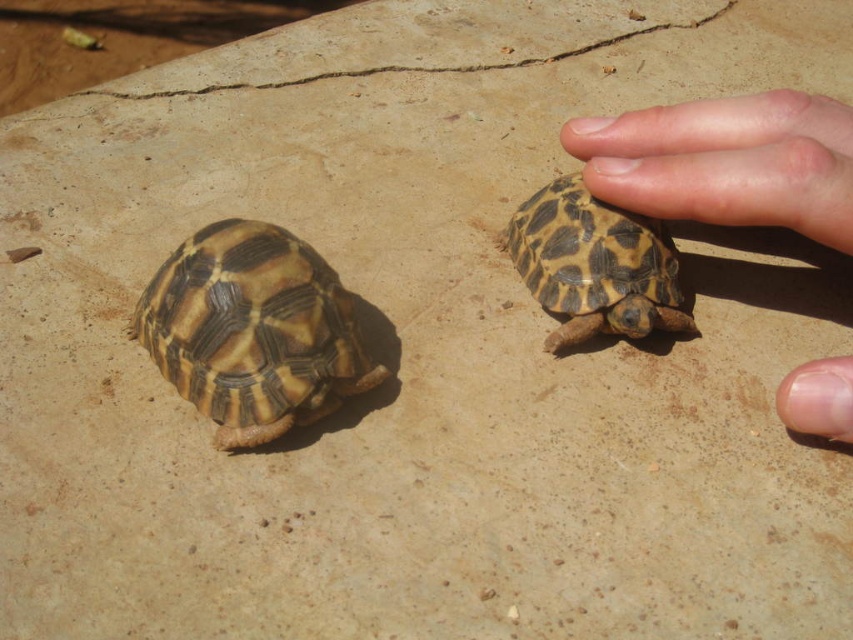
Can you confirm if brown textured tortoise at left is bigger than pale skin at upper right?

Actually, brown textured tortoise at left might be smaller than pale skin at upper right.

Does brown textured tortoise at left have a smaller size compared to pale skin at upper right?

Yes.

Does point (212, 392) come closer to viewer compared to point (796, 106)?

No, it is not.

I want to click on brown textured tortoise at left, so click(x=252, y=330).

Is pale skin at upper right in front of patterned shell tortoise at center?

Yes, it is.

Is pale skin at upper right to the left of patterned shell tortoise at center from the viewer's perspective?

No, pale skin at upper right is not to the left of patterned shell tortoise at center.

Looking at this image, who is more distant from viewer, (706, 120) or (648, 300)?

The point (648, 300) is behind.

This screenshot has height=640, width=853. What are the coordinates of `pale skin at upper right` in the screenshot? It's located at (727, 163).

Which of these two, smooth skin hand at right or patterned shell tortoise at center, stands taller?

Standing taller between the two is smooth skin hand at right.

Who is more forward, [762,157] or [654,282]?

Point [762,157] is in front.

Is point (645, 122) closer to viewer compared to point (657, 317)?

Yes, it is.

The image size is (853, 640). In order to click on smooth skin hand at right in this screenshot , I will do `click(727, 163)`.